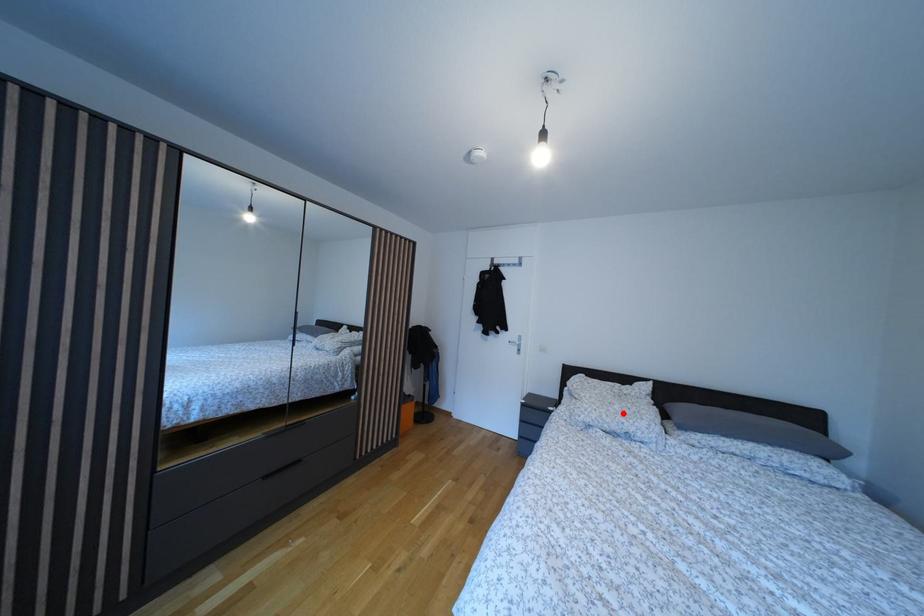
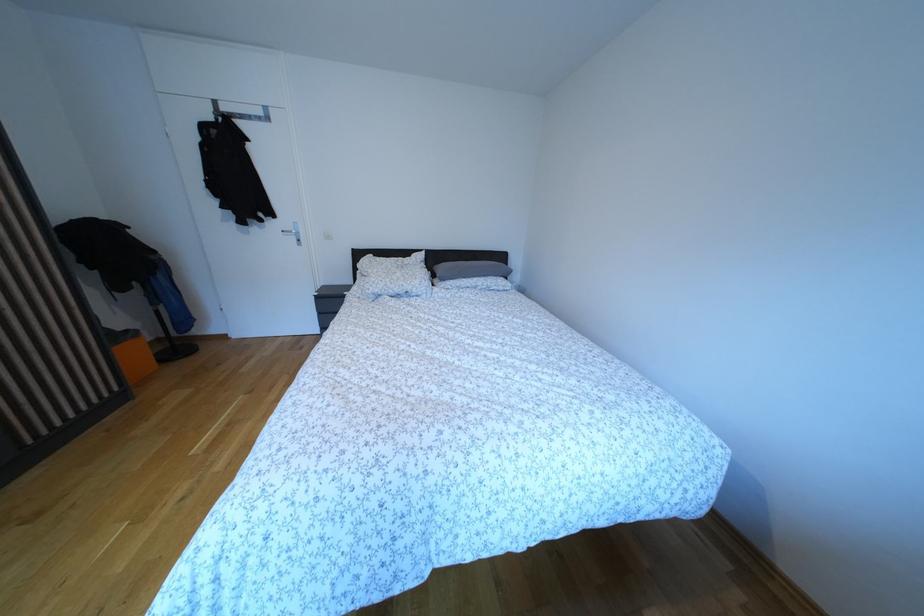
Locate, in the second image, the point that corresponds to the highlighted location in the first image.

(406, 281)